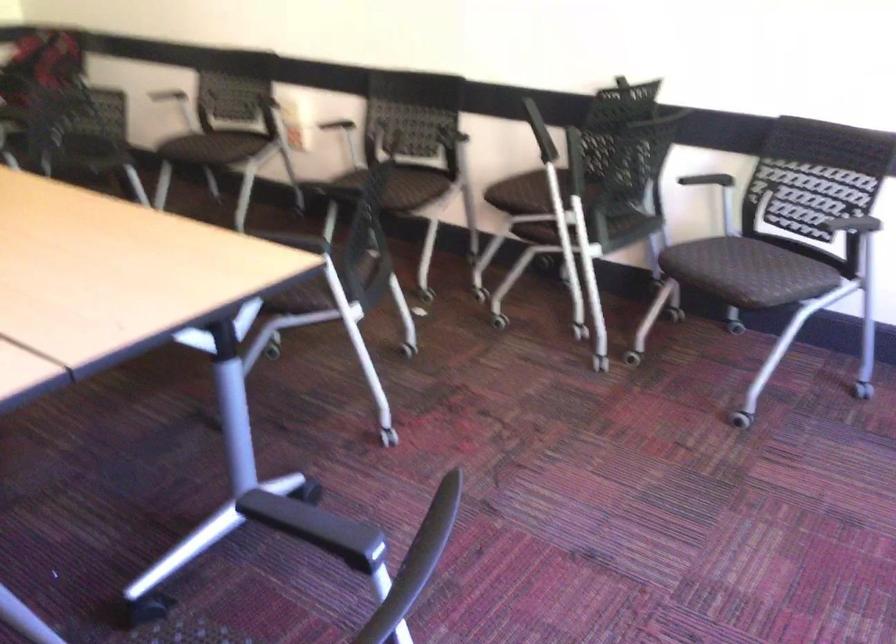
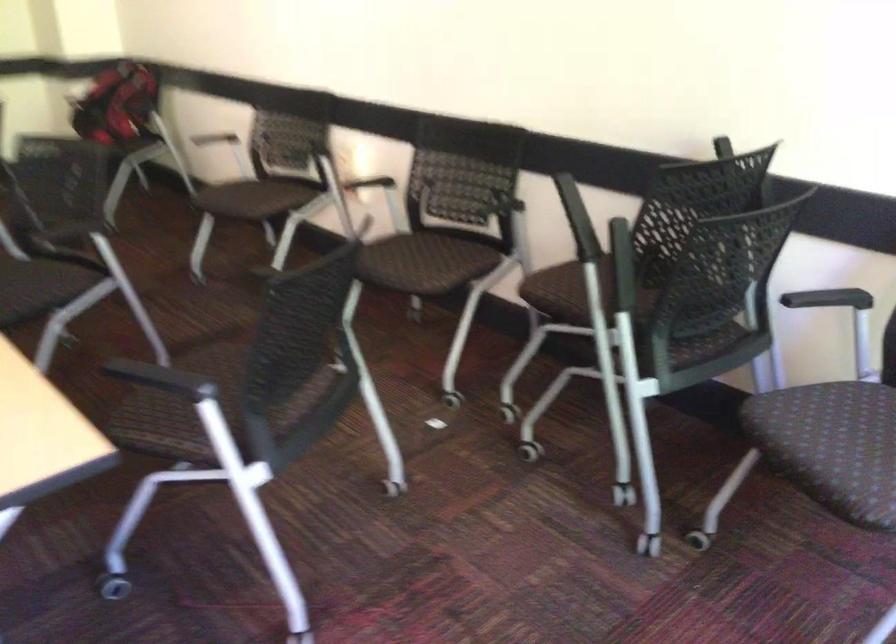
Question: The first image is from the beginning of the video and the second image is from the end. How did the camera likely rotate when shooting the video?

Choices:
 (A) Left
 (B) Right
 (C) Up
 (D) Down

Answer: (A)